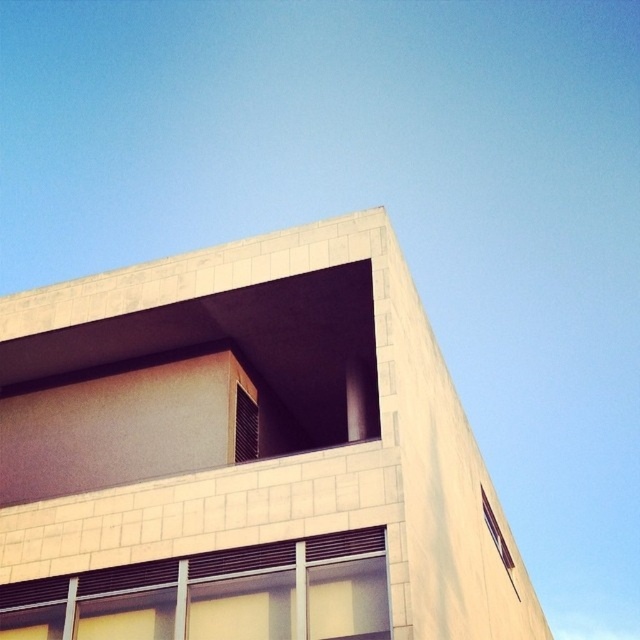
You are an architect analyzing the building structure. You need to determine which window, the white textured window at lower center or the transparent glass window at upper right, has a larger width. Based on the scene description, can you conclude which one is wider?

The white textured window at lower center might be wider than transparent glass window at upper right, so it is possible that the white textured window at lower center is wider.

You are an architect evaluating the building design. You notice the white textured window at lower center and the transparent glass window at upper right. Which window is shorter in height?

The white textured window at lower center is shorter in height than the transparent glass window at upper right.